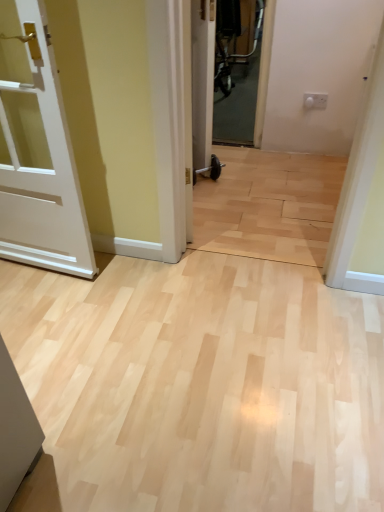
This screenshot has width=384, height=512. What are the coordinates of `vacant space to the right of white matte door at left, which ranks as the 2th door in top-to-bottom order` in the screenshot? It's located at (120, 306).